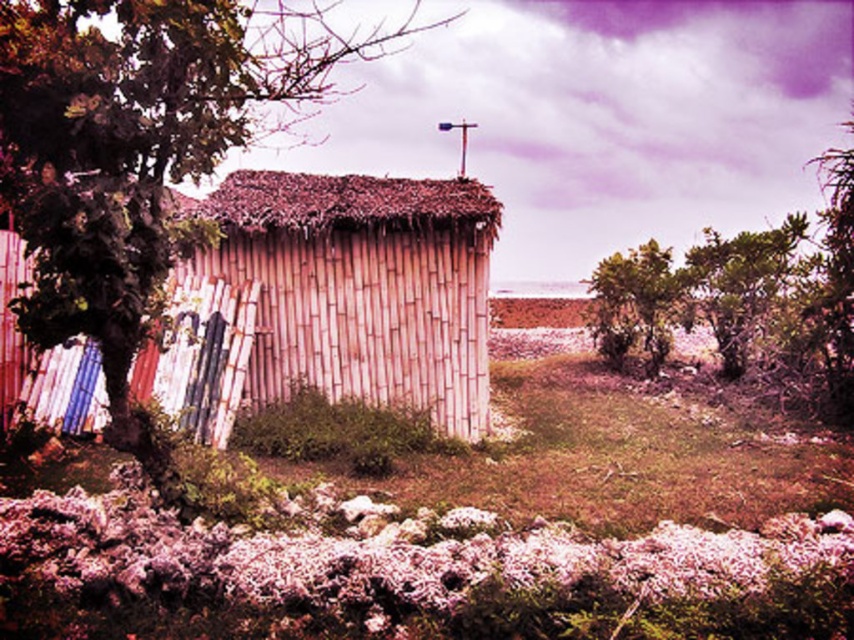
Based on the photo, which of these two, bamboo hut at center or green leafy tree at center, stands taller?

With more height is bamboo hut at center.

Which is more to the left, bamboo hut at center or green leafy tree at center?

Positioned to the left is bamboo hut at center.

Describe the element at coordinates (361, 288) in the screenshot. I see `bamboo hut at center` at that location.

The image size is (854, 640). I want to click on bamboo hut at center, so click(361, 288).

Does wooden planks at left appear on the right side of green leafy tree at upper right?

In fact, wooden planks at left is to the left of green leafy tree at upper right.

Looking at this image, who is higher up, wooden planks at left or green leafy tree at upper right?

Positioned higher is green leafy tree at upper right.

Between point (232, 292) and point (711, 275), which one is positioned behind?

The point (711, 275) is more distant.

This screenshot has width=854, height=640. Find the location of `wooden planks at left`. wooden planks at left is located at coordinates (200, 355).

Does bamboo hut at center come behind green leafy tree at upper right?

No, it is not.

Does point (448, 310) lie in front of point (740, 230)?

Yes, point (448, 310) is in front of point (740, 230).

Is point (317, 220) in front of point (773, 241)?

Yes, it is.

Locate an element on the screen. Image resolution: width=854 pixels, height=640 pixels. bamboo hut at center is located at coordinates pos(361,288).